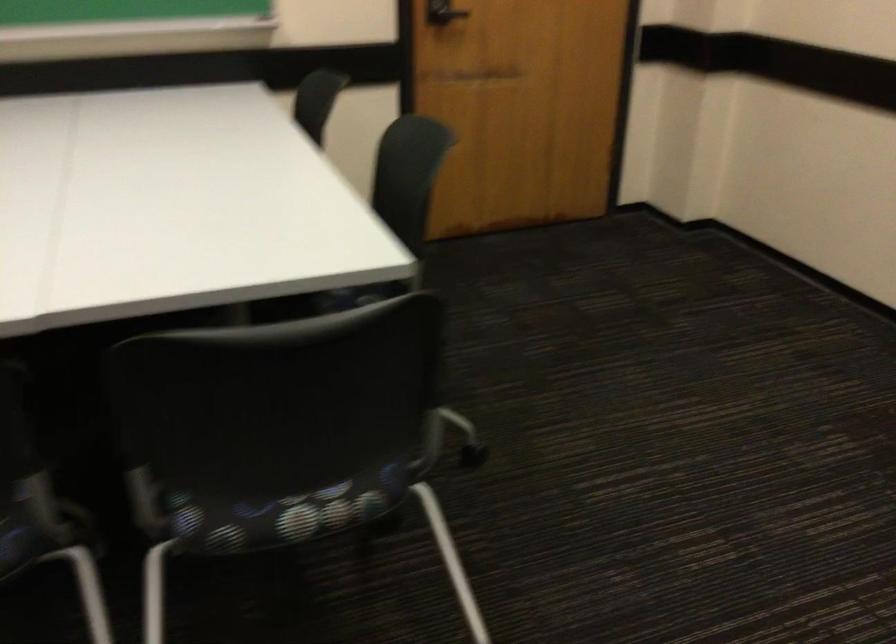
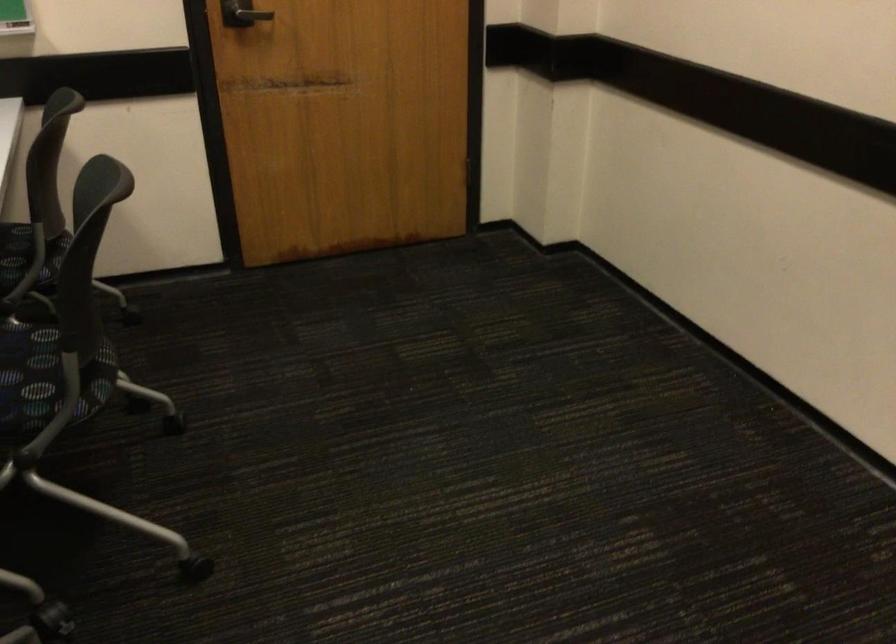
The point at (x=352, y=297) is marked in the first image. Where is the corresponding point in the second image?

(47, 374)